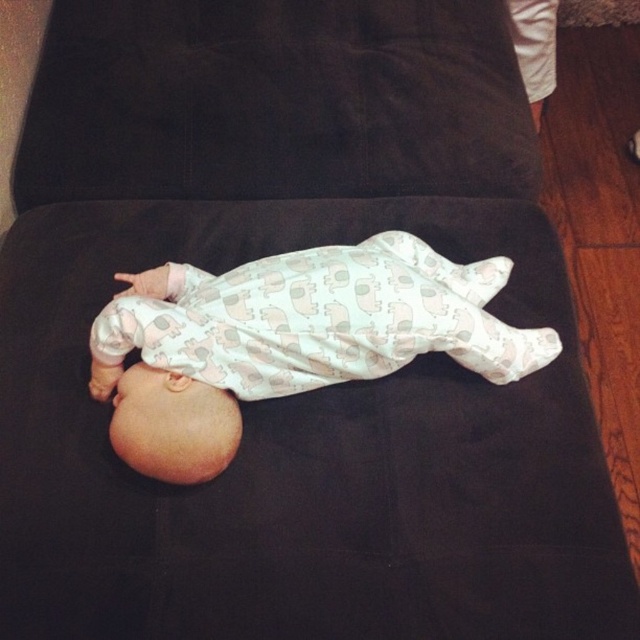
Between black suede pillow at center and white printed fabric baby at center, which one has less height?

Standing shorter between the two is white printed fabric baby at center.

This screenshot has height=640, width=640. What do you see at coordinates (275, 100) in the screenshot?
I see `black suede pillow at center` at bounding box center [275, 100].

What do you see at coordinates (275, 100) in the screenshot? The width and height of the screenshot is (640, 640). I see `black suede pillow at center` at bounding box center [275, 100].

Identify the location of black suede pillow at center. This screenshot has width=640, height=640. (275, 100).